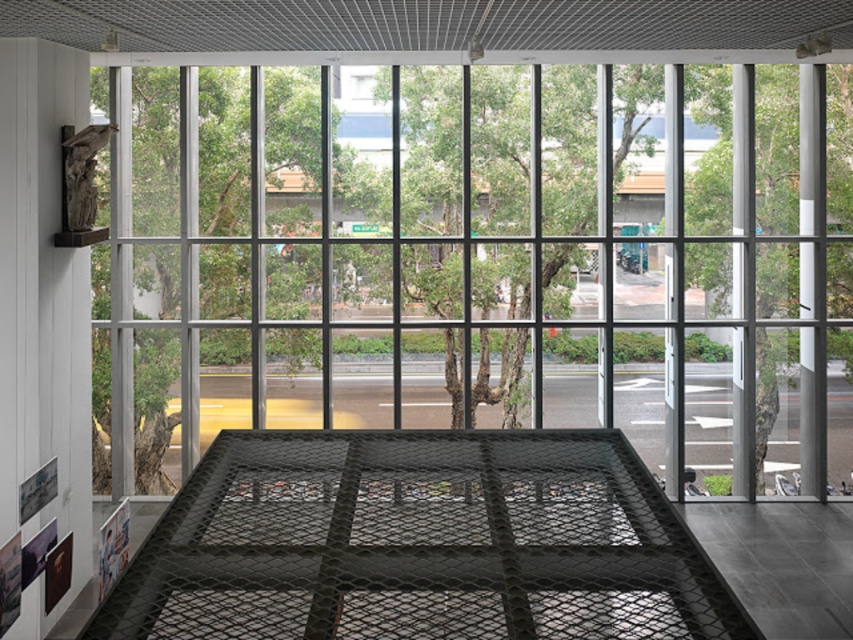
Question: Is transparent glass door at center below black mesh cage at center?

Choices:
 (A) no
 (B) yes

Answer: (A)

Question: Does transparent glass door at center come behind black mesh cage at center?

Choices:
 (A) no
 (B) yes

Answer: (B)

Question: Which point is farther to the camera?

Choices:
 (A) (802, 400)
 (B) (572, 500)
 (C) (543, 387)

Answer: (C)

Question: Based on their relative distances, which object is nearer to the transparent glass door at center?

Choices:
 (A) black mesh cage at center
 (B) white glossy pillar at right

Answer: (B)

Question: Which object appears closest to the camera in this image?

Choices:
 (A) transparent glass door at center
 (B) black mesh cage at center

Answer: (B)

Question: Is transparent glass door at center closer to the viewer compared to white glossy pillar at right?

Choices:
 (A) no
 (B) yes

Answer: (B)